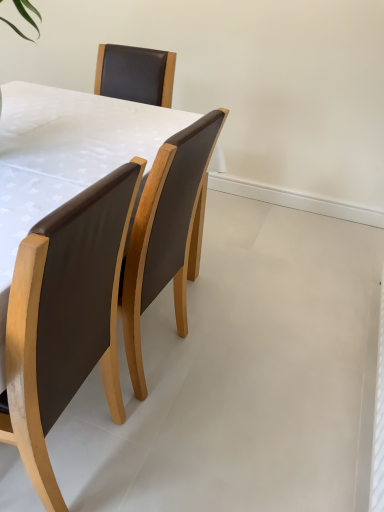
You are a GUI agent. You are given a task and a screenshot of the screen. Output one action in this format:
    pyautogui.click(x=<x>, y=<y>)
    Task: Click on the vacant area on the back side of brown leather table at center
    
    Given the screenshot: What is the action you would take?
    pyautogui.click(x=194, y=298)